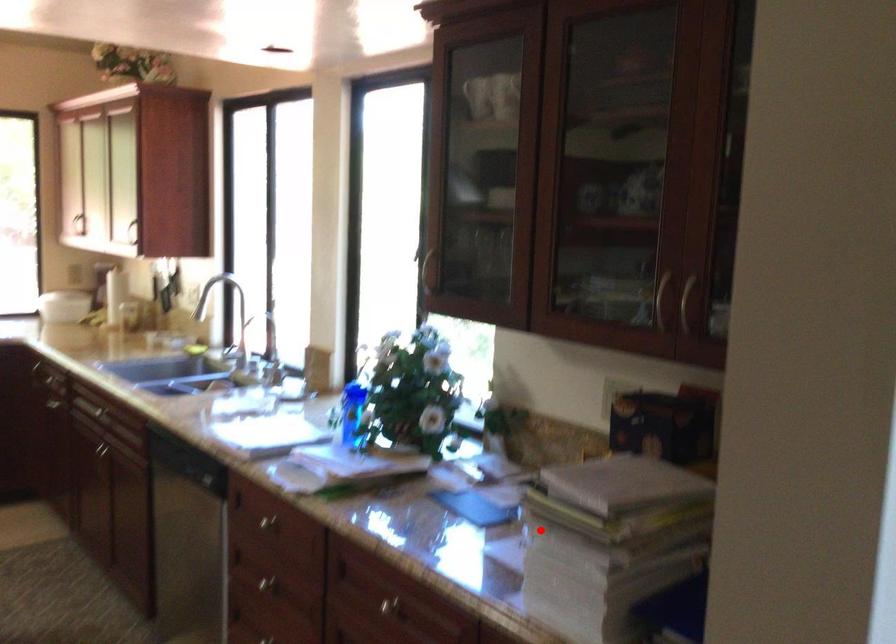
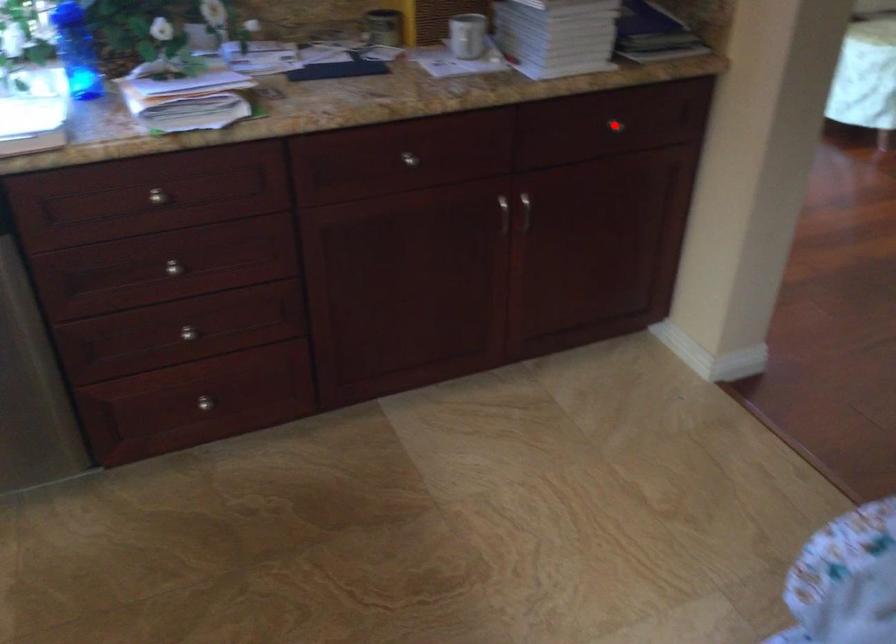
I am providing you with two images of the same scene from different viewpoints. A red point is marked on the first image and another point is marked on the second image. Do the highlighted points in image1 and image2 indicate the same real-world spot?

No